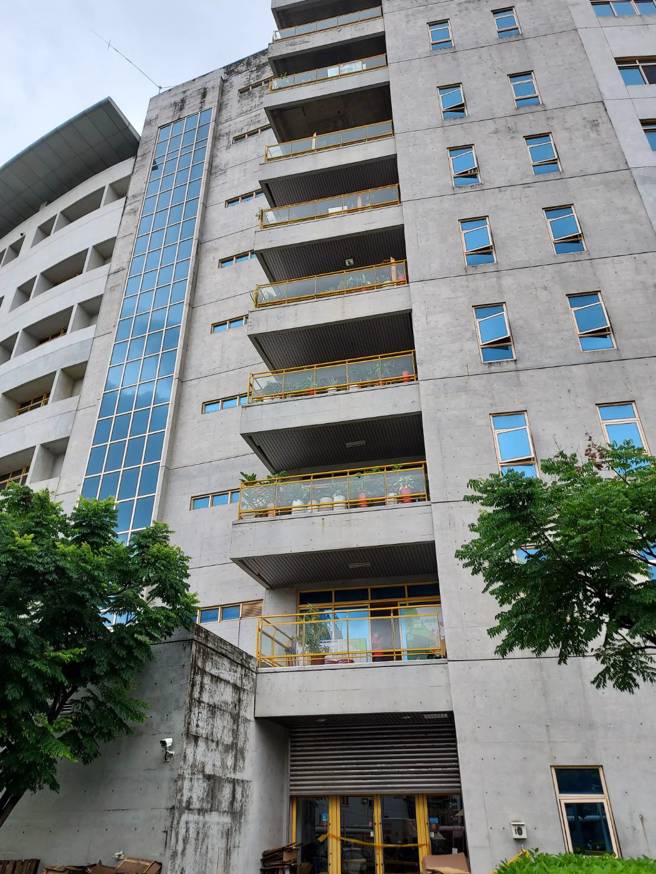
Find the location of a particular element. The image size is (656, 874). doors is located at coordinates (300, 823), (359, 822), (401, 823), (441, 823).